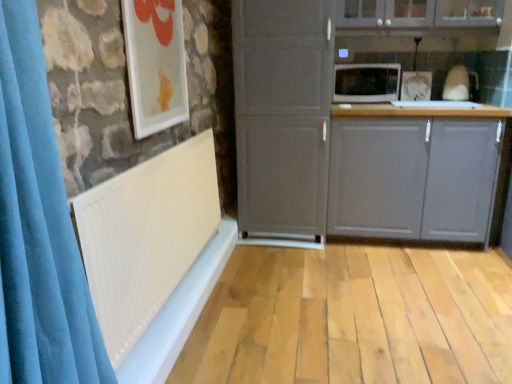
I want to click on velvet blue shower curtain at left, so 38,227.

Where is `matte gray cabinet at upper center, placed as the first cabinetry when sorted from top to bottom`? This screenshot has height=384, width=512. matte gray cabinet at upper center, placed as the first cabinetry when sorted from top to bottom is located at coordinates (417, 13).

Find the location of `white glossy microwave at upper center`. white glossy microwave at upper center is located at coordinates (367, 83).

From the image's perspective, which is below, velvet blue shower curtain at left or matte gray cabinet at center, positioned as the 1th cabinetry in bottom-to-top order?

velvet blue shower curtain at left appears lower in the image.

Considering the sizes of objects velvet blue shower curtain at left and matte gray cabinet at center, positioned as the 1th cabinetry in bottom-to-top order, in the image provided, who is shorter, velvet blue shower curtain at left or matte gray cabinet at center, positioned as the 1th cabinetry in bottom-to-top order,?

matte gray cabinet at center, positioned as the 1th cabinetry in bottom-to-top order, is shorter.

Is velvet blue shower curtain at left looking in the opposite direction of matte gray cabinet at center, which is the second cabinetry from top to bottom?

No, matte gray cabinet at center, which is the second cabinetry from top to bottom, is not at the back of velvet blue shower curtain at left.

Would you say velvet blue shower curtain at left is inside or outside matte gray cabinet at center, which is the second cabinetry from top to bottom?

velvet blue shower curtain at left cannot be found inside matte gray cabinet at center, which is the second cabinetry from top to bottom.

Who is taller, white glossy picture frame at upper left or white matte radiator at left?

Standing taller between the two is white matte radiator at left.

From a real-world perspective, between white glossy picture frame at upper left and white matte radiator at left, who is vertically lower?

white matte radiator at left.

Is white glossy picture frame at upper left spatially inside white matte radiator at left, or outside of it?

white glossy picture frame at upper left is not enclosed by white matte radiator at left.

Considering the sizes of objects white glossy picture frame at upper left and white matte radiator at left in the image provided, who is thinner, white glossy picture frame at upper left or white matte radiator at left?

white glossy picture frame at upper left is thinner.

Does point (158, 87) appear closer or farther from the camera than point (484, 233)?

Clearly, point (158, 87) is closer to the camera than point (484, 233).

Does white glossy picture frame at upper left appear on the left side of matte gray cabinet at center, which is the second cabinetry from top to bottom?

Yes, white glossy picture frame at upper left is to the left of matte gray cabinet at center, which is the second cabinetry from top to bottom.

From a real-world perspective, relative to matte gray cabinet at center, positioned as the 1th cabinetry in bottom-to-top order, is white glossy picture frame at upper left vertically above or below?

In terms of real-world spatial position, white glossy picture frame at upper left is above matte gray cabinet at center, positioned as the 1th cabinetry in bottom-to-top order.

Considering the sizes of white glossy picture frame at upper left and matte gray cabinet at center, which is the second cabinetry from top to bottom, in the image, is white glossy picture frame at upper left wider or thinner than matte gray cabinet at center, which is the second cabinetry from top to bottom,?

In the image, white glossy picture frame at upper left appears to be more narrow than matte gray cabinet at center, which is the second cabinetry from top to bottom.

Is velvet blue shower curtain at left located outside white matte radiator at left?

velvet blue shower curtain at left lies outside white matte radiator at left's area.

Can you confirm if velvet blue shower curtain at left is positioned to the left of white matte radiator at left?

Correct, you'll find velvet blue shower curtain at left to the left of white matte radiator at left.

From a real-world perspective, which object stands above the other?

velvet blue shower curtain at left is physically above.

Is velvet blue shower curtain at left oriented away from white matte radiator at left?

velvet blue shower curtain at left is not turned away from white matte radiator at left.

From a real-world perspective, is white matte radiator at left on top of matte gray cabinet at upper center, marked as the 2th cabinetry in a bottom-to-top arrangement?

Actually, white matte radiator at left is physically below matte gray cabinet at upper center, marked as the 2th cabinetry in a bottom-to-top arrangement, in the real world.

Could you tell me if white matte radiator at left is facing matte gray cabinet at upper center, placed as the first cabinetry when sorted from top to bottom?

No, white matte radiator at left is not turned towards matte gray cabinet at upper center, placed as the first cabinetry when sorted from top to bottom.

Is white matte radiator at left wider or thinner than matte gray cabinet at upper center, marked as the 2th cabinetry in a bottom-to-top arrangement?

Considering their sizes, white matte radiator at left looks slimmer than matte gray cabinet at upper center, marked as the 2th cabinetry in a bottom-to-top arrangement.

Does matte gray cabinet at center, positioned as the 1th cabinetry in bottom-to-top order, touch white glossy picture frame at upper left?

No, matte gray cabinet at center, positioned as the 1th cabinetry in bottom-to-top order, is not in contact with white glossy picture frame at upper left.

Considering the relative sizes of matte gray cabinet at center, positioned as the 1th cabinetry in bottom-to-top order, and white glossy picture frame at upper left in the image provided, is matte gray cabinet at center, positioned as the 1th cabinetry in bottom-to-top order, wider than white glossy picture frame at upper left?

Yes.

From the picture: From the image's perspective, is matte gray cabinet at center, positioned as the 1th cabinetry in bottom-to-top order, located beneath white glossy picture frame at upper left?

Yes, from the image's perspective, matte gray cabinet at center, positioned as the 1th cabinetry in bottom-to-top order, is beneath white glossy picture frame at upper left.

Considering the relative sizes of matte gray cabinet at center, positioned as the 1th cabinetry in bottom-to-top order, and white glossy picture frame at upper left in the image provided, is matte gray cabinet at center, positioned as the 1th cabinetry in bottom-to-top order, taller than white glossy picture frame at upper left?

Yes.

What's the angular difference between velvet blue shower curtain at left and matte gray cupboard at center's facing directions?

89.8 degrees separate the facing orientations of velvet blue shower curtain at left and matte gray cupboard at center.

Is velvet blue shower curtain at left not within matte gray cupboard at center?

Yes.

Are velvet blue shower curtain at left and matte gray cupboard at center far apart?

velvet blue shower curtain at left is far away from matte gray cupboard at center.

There is a matte gray cabinet at center, which is the second cabinetry from top to bottom. Identify the location of shower curtain above it (from a real-world perspective). This screenshot has width=512, height=384. (38, 227).

Where is `radiator below the white glossy picture frame at upper left (from the image's perspective)`? This screenshot has height=384, width=512. radiator below the white glossy picture frame at upper left (from the image's perspective) is located at coordinates (146, 242).

Considering their positions, is white glossy picture frame at upper left positioned further to matte gray cupboard at center than matte gray cabinet at upper center, placed as the first cabinetry when sorted from top to bottom?

Answer: white glossy picture frame at upper left is positioned further to the anchor matte gray cupboard at center.

Based on their spatial positions, is matte gray cupboard at center or white glossy picture frame at upper left further from matte gray cabinet at center, positioned as the 1th cabinetry in bottom-to-top order?

The object further to matte gray cabinet at center, positioned as the 1th cabinetry in bottom-to-top order, is white glossy picture frame at upper left.

Which object lies further to the anchor point white matte radiator at left, matte gray cabinet at center, which is the second cabinetry from top to bottom, or matte gray cupboard at center?

The object further to white matte radiator at left is matte gray cabinet at center, which is the second cabinetry from top to bottom.

Estimate the real-world distances between objects in this image. Which object is closer to velvet blue shower curtain at left, white matte radiator at left or matte gray cupboard at center?

Based on the image, white matte radiator at left appears to be nearer to velvet blue shower curtain at left.

Looking at the image, which one is located closer to matte gray cupboard at center, white matte radiator at left or white glossy picture frame at upper left?

Based on the image, white glossy picture frame at upper left appears to be nearer to matte gray cupboard at center.

When comparing their distances from matte gray cabinet at center, which is the second cabinetry from top to bottom, does matte gray cupboard at center or matte gray cabinet at upper center, marked as the 2th cabinetry in a bottom-to-top arrangement, seem closer?

Based on the image, matte gray cupboard at center appears to be nearer to matte gray cabinet at center, which is the second cabinetry from top to bottom.

Which object lies nearer to the anchor point white glossy picture frame at upper left, white glossy microwave at upper center or matte gray cupboard at center?

Among the two, matte gray cupboard at center is located nearer to white glossy picture frame at upper left.

Which object lies nearer to the anchor point matte gray cabinet at upper center, marked as the 2th cabinetry in a bottom-to-top arrangement, white glossy picture frame at upper left or matte gray cupboard at center?

The object closer to matte gray cabinet at upper center, marked as the 2th cabinetry in a bottom-to-top arrangement, is matte gray cupboard at center.

Where is `microwave oven between matte gray cupboard at center and matte gray cabinet at upper center, marked as the 2th cabinetry in a bottom-to-top arrangement, in the horizontal direction`? The width and height of the screenshot is (512, 384). microwave oven between matte gray cupboard at center and matte gray cabinet at upper center, marked as the 2th cabinetry in a bottom-to-top arrangement, in the horizontal direction is located at coordinates (367, 83).

In order to click on microwave oven located between matte gray cupboard at center and matte gray cabinet at center, which is the second cabinetry from top to bottom, in the left-right direction in this screenshot , I will do `click(367, 83)`.

Where is `cupboard between matte gray cabinet at upper center, placed as the first cabinetry when sorted from top to bottom, and matte gray cabinet at center, which is the second cabinetry from top to bottom, in the up-down direction`? cupboard between matte gray cabinet at upper center, placed as the first cabinetry when sorted from top to bottom, and matte gray cabinet at center, which is the second cabinetry from top to bottom, in the up-down direction is located at coordinates (282, 116).

The image size is (512, 384). What are the coordinates of `picture frame located between white matte radiator at left and white glossy microwave at upper center in the depth direction` in the screenshot? It's located at (155, 64).